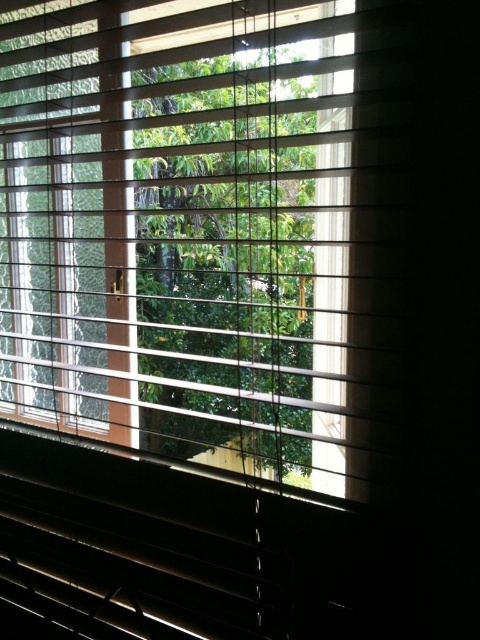
Between wooden blinds at center and green leafy tree at center, which one appears on the right side from the viewer's perspective?

green leafy tree at center is more to the right.

Is point (259, 444) behind point (301, 403)?

Yes.

Does point (379, 225) come closer to viewer compared to point (254, 284)?

Yes.

This screenshot has height=640, width=480. I want to click on wooden blinds at center, so click(x=206, y=230).